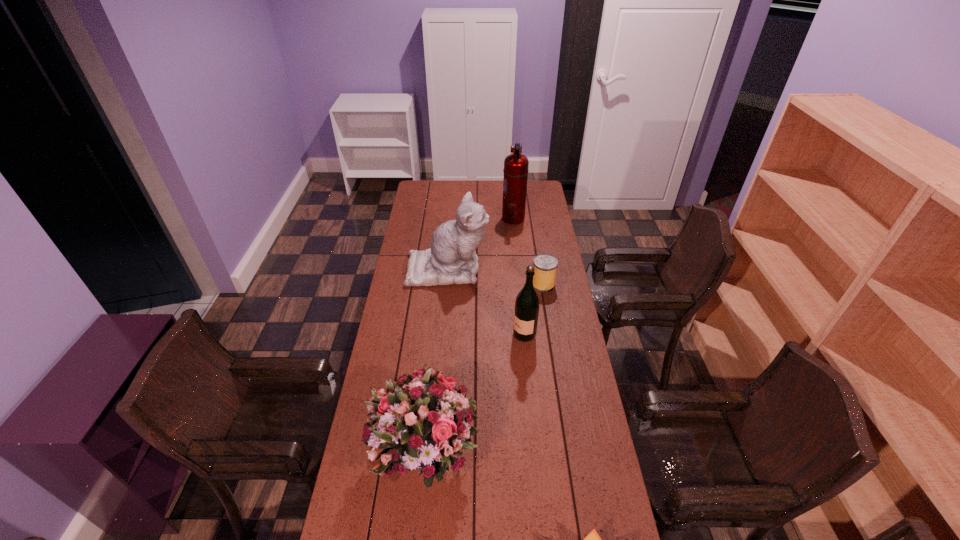
The image size is (960, 540). Find the location of `vacant space that satisfies the following two spatial constraints: 1. on the nozzle side of the can; 2. on the right side of the fire extinguisher`. vacant space that satisfies the following two spatial constraints: 1. on the nozzle side of the can; 2. on the right side of the fire extinguisher is located at coordinates (520, 284).